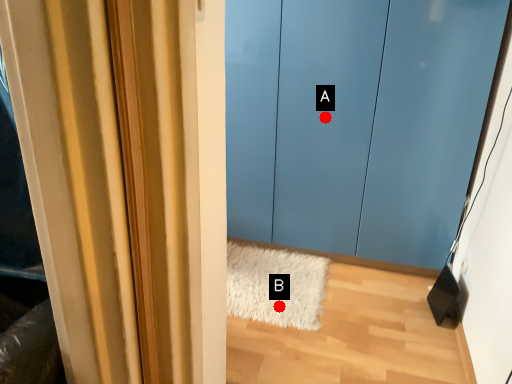
Question: Two points are circled on the image, labeled by A and B beside each circle. Among these points, which one is farthest from the camera?

Choices:
 (A) A is further
 (B) B is further

Answer: (A)